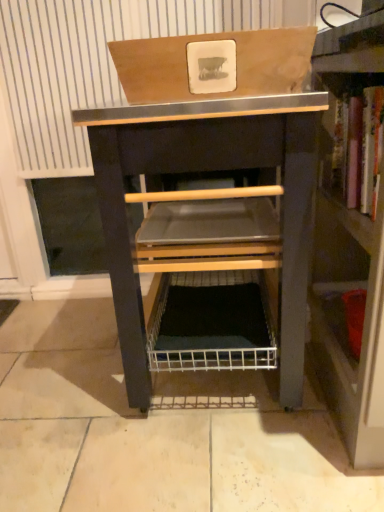
Question: In terms of size, does wooden bookshelf at right appear bigger or smaller than wooden box at upper center?

Choices:
 (A) small
 (B) big

Answer: (B)

Question: Is wooden bookshelf at right taller or shorter than wooden box at upper center?

Choices:
 (A) short
 (B) tall

Answer: (B)

Question: Which of these objects is positioned closest to the wooden bookshelf at right?

Choices:
 (A) wooden box at upper center
 (B) black metal/wooden vanity at center

Answer: (B)

Question: Estimate the real-world distances between objects in this image. Which object is farther from the black metal/wooden vanity at center?

Choices:
 (A) wooden box at upper center
 (B) wooden bookshelf at right

Answer: (B)